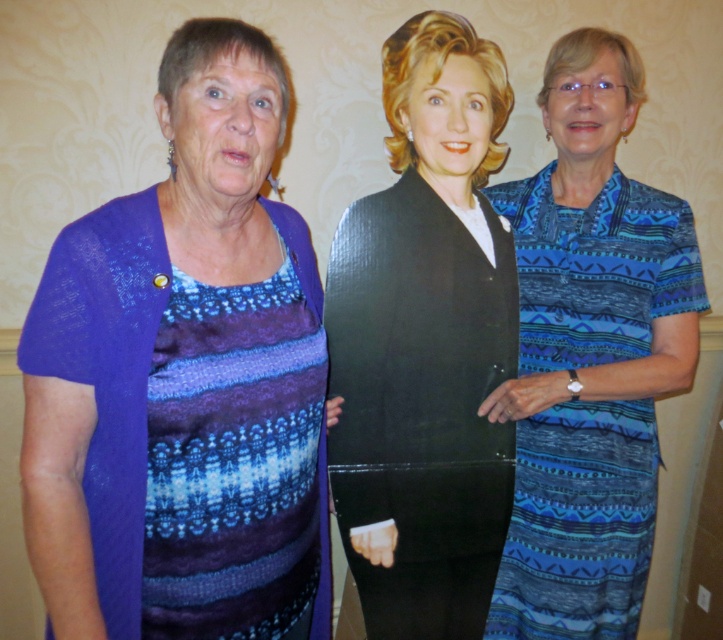
You are organizing a fashion show and need to arrange the knitted purple cardigan at left and the blue printed dress at right in a display case. The display case has a divider in the middle. Which side of the divider should each item be placed to maintain their original positions?

The knitted purple cardigan at left should be placed on the left side of the divider, and the blue printed dress at right should be placed on the right side of the divider to maintain their original positions since the knitted purple cardigan at left is positioned on the left side of blue printed dress at right.